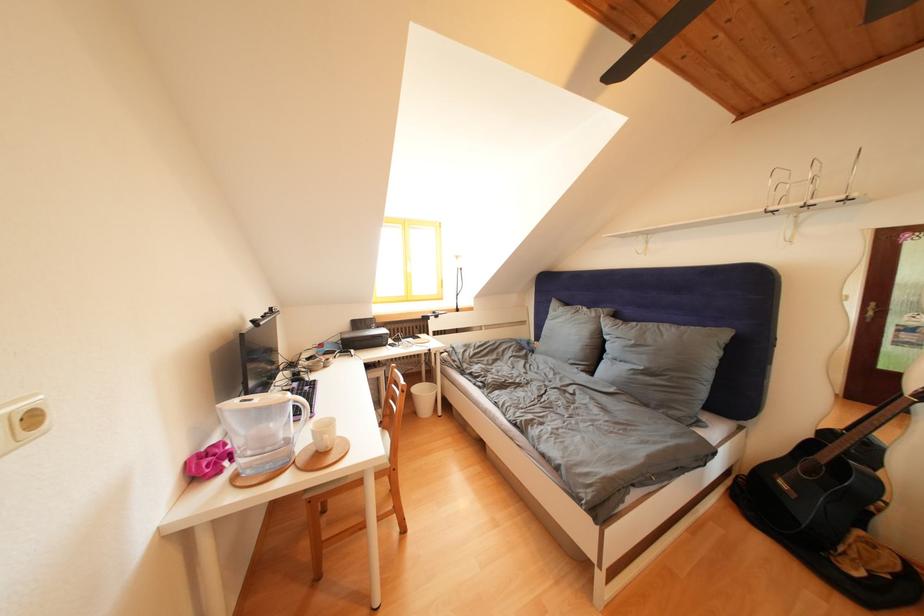
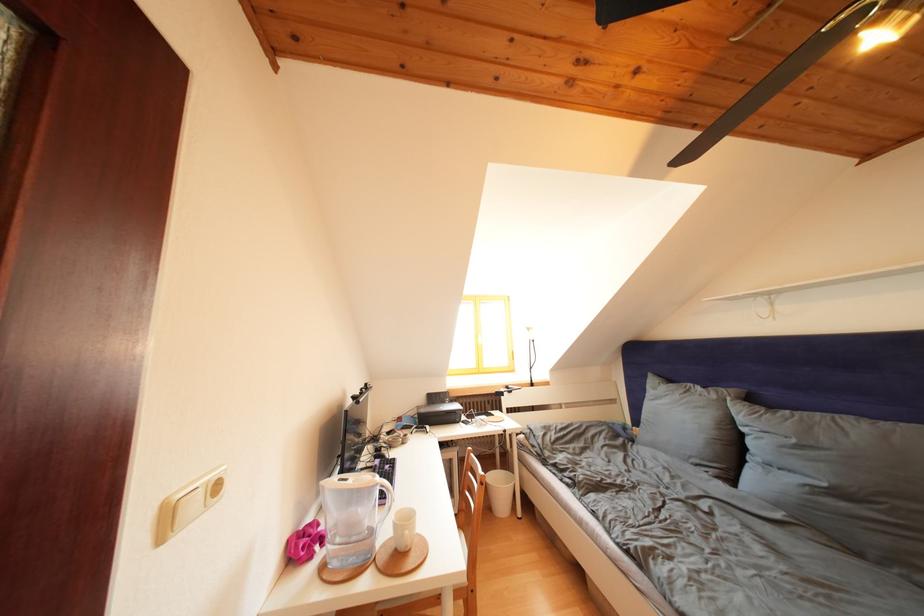
Locate, in the second image, the point that corresponds to pixel 393 373 in the first image.

(466, 454)